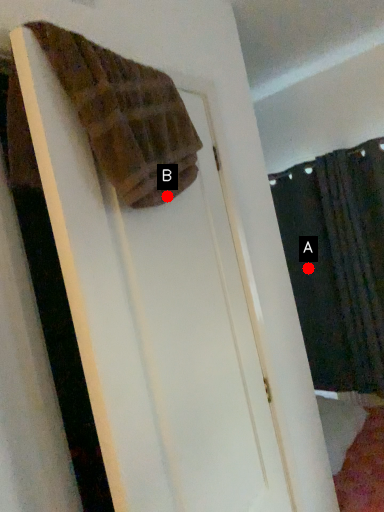
Question: Two points are circled on the image, labeled by A and B beside each circle. Which point is closer to the camera?

Choices:
 (A) A is closer
 (B) B is closer

Answer: (B)